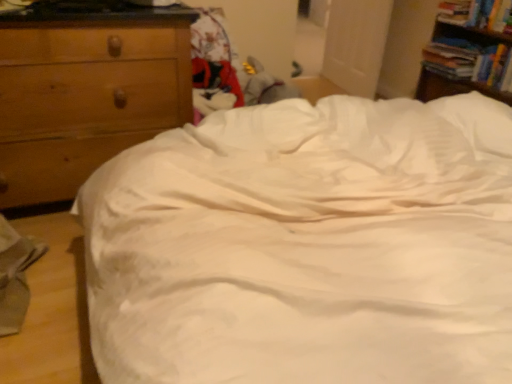
Question: From their relative heights in the image, would you say wooden chest of drawers at left is taller or shorter than hardcover book at upper right, which is counted as the 3th book, starting from the bottom?

Choices:
 (A) tall
 (B) short

Answer: (A)

Question: Looking at their shapes, would you say wooden chest of drawers at left is wider or thinner than hardcover book at upper right, marked as the 1th book in a top-to-bottom arrangement?

Choices:
 (A) thin
 (B) wide

Answer: (B)

Question: Estimate the real-world distances between objects in this image. Which object is closer to the hardcover book at upper right, marked as the 3th book in a top-to-bottom arrangement?

Choices:
 (A) wooden chest of drawers at left
 (B) hardcover book at upper right, which is the second book from top to bottom
 (C) white satin bed at center
 (D) hardcover book at upper right, which is counted as the 3th book, starting from the bottom
 (E) wooden bookshelf at upper right

Answer: (E)

Question: Based on their relative distances, which object is nearer to the hardcover book at upper right, the first book positioned from the bottom?

Choices:
 (A) wooden chest of drawers at left
 (B) wooden bookshelf at upper right
 (C) white satin bed at center
 (D) hardcover book at upper right, the 2th book in the bottom-to-top sequence
 (E) hardcover book at upper right, marked as the 1th book in a top-to-bottom arrangement

Answer: (B)